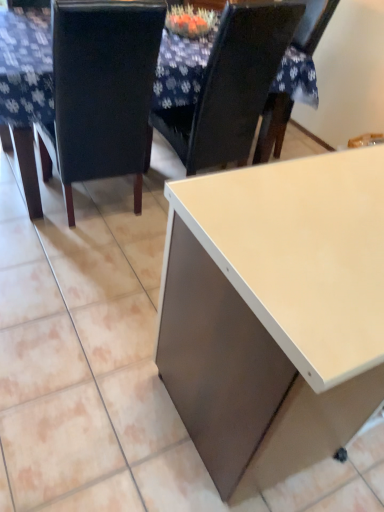
Question: From a real-world perspective, is white glossy table at center on top of matte black chair at upper center, positioned as the second chair in left-to-right order?

Choices:
 (A) no
 (B) yes

Answer: (A)

Question: Considering the relative positions of white glossy table at center and matte black chair at upper center, positioned as the second chair in left-to-right order, in the image provided, is white glossy table at center to the left of matte black chair at upper center, positioned as the second chair in left-to-right order, from the viewer's perspective?

Choices:
 (A) no
 (B) yes

Answer: (B)

Question: Is the surface of white glossy table at center in direct contact with matte black chair at upper center, acting as the 1th chair starting from the right?

Choices:
 (A) no
 (B) yes

Answer: (A)

Question: From the image's perspective, is white glossy table at center below matte black chair at upper center, acting as the 1th chair starting from the right?

Choices:
 (A) no
 (B) yes

Answer: (A)

Question: Is white glossy table at center thinner than matte black chair at upper center, acting as the 1th chair starting from the right?

Choices:
 (A) yes
 (B) no

Answer: (B)

Question: Looking at their shapes, would you say matte black chair at upper center, acting as the 1th chair starting from the right, is wider or thinner than white glossy table at center?

Choices:
 (A) wide
 (B) thin

Answer: (B)

Question: From a real-world perspective, is matte black chair at upper center, acting as the 1th chair starting from the right, physically located above or below white glossy table at center?

Choices:
 (A) below
 (B) above

Answer: (B)

Question: In terms of size, does matte black chair at upper center, acting as the 1th chair starting from the right, appear bigger or smaller than white glossy table at center?

Choices:
 (A) big
 (B) small

Answer: (B)

Question: Considering the positions of matte black chair at upper center, positioned as the second chair in left-to-right order, and white glossy table at center in the image, is matte black chair at upper center, positioned as the second chair in left-to-right order, taller or shorter than white glossy table at center?

Choices:
 (A) tall
 (B) short

Answer: (A)

Question: Is point (248, 132) closer or farther from the camera than point (294, 173)?

Choices:
 (A) closer
 (B) farther

Answer: (B)

Question: In terms of size, does matte black chair at upper center, acting as the 1th chair starting from the right, appear bigger or smaller than matte white desk at lower right?

Choices:
 (A) small
 (B) big

Answer: (A)

Question: In the image, is matte black chair at upper center, acting as the 1th chair starting from the right, positioned in front of or behind matte white desk at lower right?

Choices:
 (A) front
 (B) behind

Answer: (B)

Question: Is matte black chair at upper center, positioned as the second chair in left-to-right order, taller or shorter than matte white desk at lower right?

Choices:
 (A) short
 (B) tall

Answer: (B)

Question: In the image, is matte white desk at lower right positioned in front of or behind black leather chair at left, the 1th chair in the left-to-right sequence?

Choices:
 (A) front
 (B) behind

Answer: (A)

Question: From the image's perspective, relative to black leather chair at left, which appears as the second chair when viewed from the right, is matte white desk at lower right above or below?

Choices:
 (A) below
 (B) above

Answer: (A)